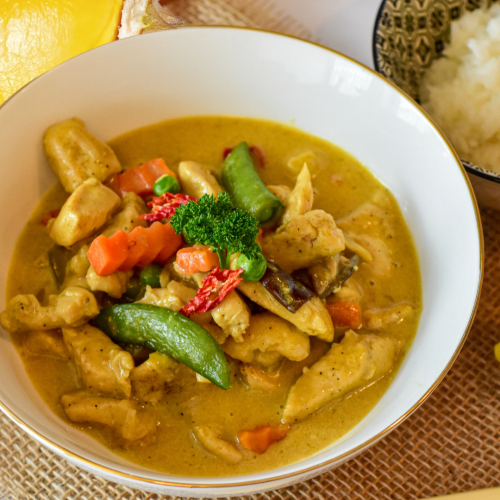
In order to click on white surface in this screenshot , I will do `click(327, 23)`.